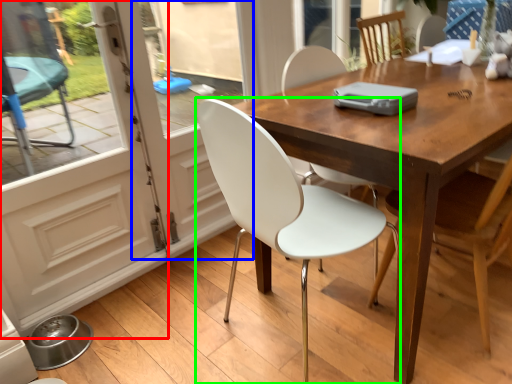
Question: Which object is the closest to the screen door (highlighted by a red box)? Choose among these: screen door (highlighted by a blue box) or chair (highlighted by a green box).

Choices:
 (A) screen door
 (B) chair

Answer: (A)